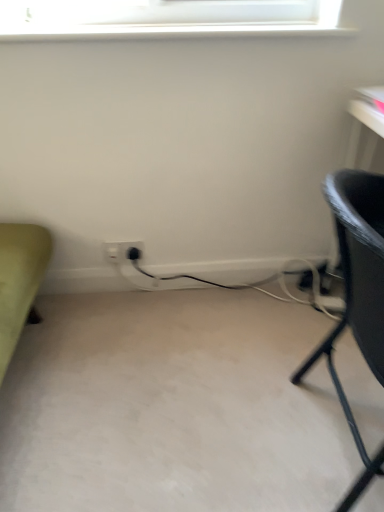
Question: Considering the relative sizes of white plastic electric outlet at lower center, the 2th electric outlet positioned from the left, and white plastic electric outlet at center, arranged as the 2th electric outlet when viewed from the right, in the image provided, is white plastic electric outlet at lower center, the 2th electric outlet positioned from the left, thinner than white plastic electric outlet at center, arranged as the 2th electric outlet when viewed from the right,?

Choices:
 (A) no
 (B) yes

Answer: (B)

Question: Are white plastic electric outlet at lower center, positioned as the first electric outlet in right-to-left order, and white plastic electric outlet at center, arranged as the 2th electric outlet when viewed from the right, beside each other?

Choices:
 (A) yes
 (B) no

Answer: (A)

Question: From a real-world perspective, is white plastic electric outlet at lower center, positioned as the first electric outlet in right-to-left order, beneath white plastic electric outlet at center, which is the 1th electric outlet from left to right?

Choices:
 (A) no
 (B) yes

Answer: (A)

Question: Can you confirm if white plastic electric outlet at lower center, the 2th electric outlet positioned from the left, is bigger than white plastic electric outlet at center, which is the 1th electric outlet from left to right?

Choices:
 (A) yes
 (B) no

Answer: (A)

Question: Considering the relative positions of white plastic electric outlet at lower center, positioned as the first electric outlet in right-to-left order, and white plastic electric outlet at center, arranged as the 2th electric outlet when viewed from the right, in the image provided, is white plastic electric outlet at lower center, positioned as the first electric outlet in right-to-left order, to the right of white plastic electric outlet at center, arranged as the 2th electric outlet when viewed from the right, from the viewer's perspective?

Choices:
 (A) yes
 (B) no

Answer: (A)

Question: From the image's perspective, is white plastic electric outlet at lower center, positioned as the first electric outlet in right-to-left order, under white plastic electric outlet at center, which is the 1th electric outlet from left to right?

Choices:
 (A) yes
 (B) no

Answer: (B)

Question: Is white plastic electric outlet at center, arranged as the 2th electric outlet when viewed from the right, to the right of black textured chair at right from the viewer's perspective?

Choices:
 (A) yes
 (B) no

Answer: (B)

Question: Considering the relative sizes of white plastic electric outlet at center, arranged as the 2th electric outlet when viewed from the right, and black textured chair at right in the image provided, is white plastic electric outlet at center, arranged as the 2th electric outlet when viewed from the right, taller than black textured chair at right?

Choices:
 (A) no
 (B) yes

Answer: (A)

Question: Is white plastic electric outlet at center, which is the 1th electric outlet from left to right, wider than black textured chair at right?

Choices:
 (A) no
 (B) yes

Answer: (A)

Question: From the image's perspective, is white plastic electric outlet at center, which is the 1th electric outlet from left to right, under black textured chair at right?

Choices:
 (A) no
 (B) yes

Answer: (A)

Question: Is white plastic electric outlet at center, which is the 1th electric outlet from left to right, not close to black textured chair at right?

Choices:
 (A) no
 (B) yes

Answer: (A)

Question: Is white plastic electric outlet at center, arranged as the 2th electric outlet when viewed from the right, turned away from black textured chair at right?

Choices:
 (A) no
 (B) yes

Answer: (A)

Question: Is black textured chair at right not near black plastic plug at lower center?

Choices:
 (A) yes
 (B) no

Answer: (B)